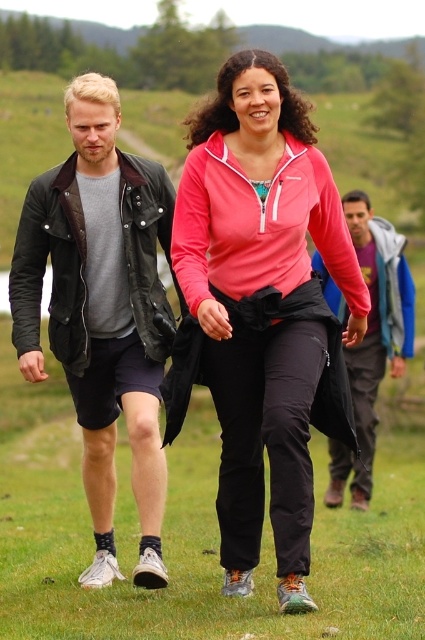
Question: Among these points, which one is nearest to the camera?

Choices:
 (A) (340, 454)
 (B) (146, 211)

Answer: (B)

Question: Which of the following is the farthest from the observer?

Choices:
 (A) (391, 340)
 (B) (67, 211)

Answer: (A)

Question: Does pink fleece jacket at center appear on the right side of blue denim jacket at center?

Choices:
 (A) yes
 (B) no

Answer: (B)

Question: Which object is positioned farthest from the suede leather jacket at left?

Choices:
 (A) blue denim jacket at center
 (B) pink fleece jacket at center

Answer: (A)

Question: Is suede leather jacket at left thinner than blue denim jacket at center?

Choices:
 (A) no
 (B) yes

Answer: (A)

Question: Can you confirm if pink fleece jacket at center is positioned below suede leather jacket at left?

Choices:
 (A) no
 (B) yes

Answer: (A)